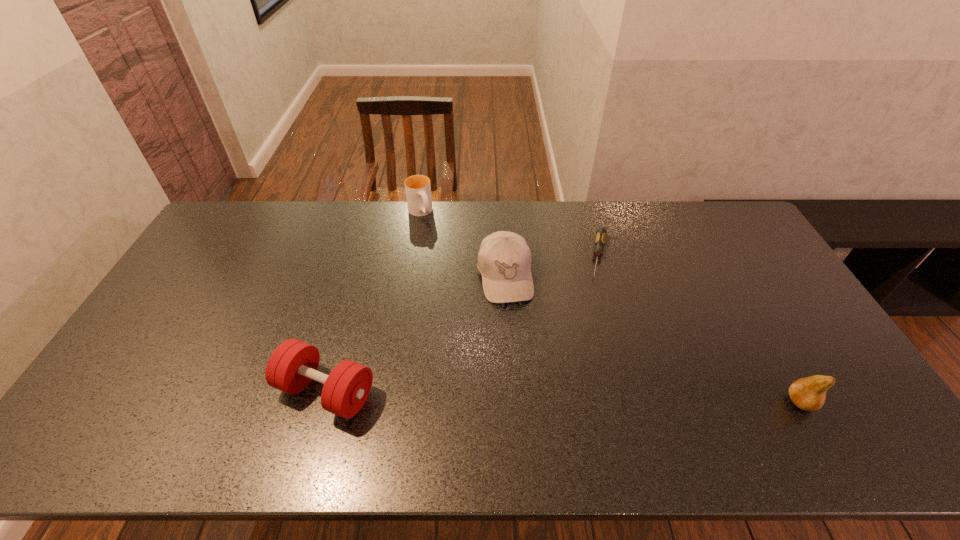
Locate an element on the screen. The width and height of the screenshot is (960, 540). free space between the baseball cap and the dumbbell is located at coordinates (416, 334).

At what (x,y) coordinates should I click in order to perform the action: click on vacant space that's between the baseball cap and the screwdriver. Please return your answer as a coordinate pair (x, y). The width and height of the screenshot is (960, 540). Looking at the image, I should click on (552, 266).

Locate an element on the screen. The width and height of the screenshot is (960, 540). empty space between the screwdriver and the third object from right to left is located at coordinates pos(552,266).

The height and width of the screenshot is (540, 960). In order to click on free space between the pear and the dumbbell in this screenshot , I will do `click(564, 396)`.

Locate an element on the screen. The image size is (960, 540). free spot between the dumbbell and the rightmost object is located at coordinates (564, 396).

This screenshot has height=540, width=960. Identify the location of unoccupied position between the farthest object and the pear. (611, 307).

The height and width of the screenshot is (540, 960). What are the coordinates of `free spot between the third object from left to right and the pear` in the screenshot? It's located at (653, 339).

Locate an element on the screen. This screenshot has height=540, width=960. empty space between the third object from right to left and the dumbbell is located at coordinates (416, 334).

Identify which object is the fourth closest to the screwdriver. Please provide its 2D coordinates. Your answer should be formatted as a tuple, i.e. [(x, y)], where the tuple contains the x and y coordinates of a point satisfying the conditions above.

[(293, 364)]

This screenshot has width=960, height=540. I want to click on object that is the closest one to the pear, so click(x=600, y=239).